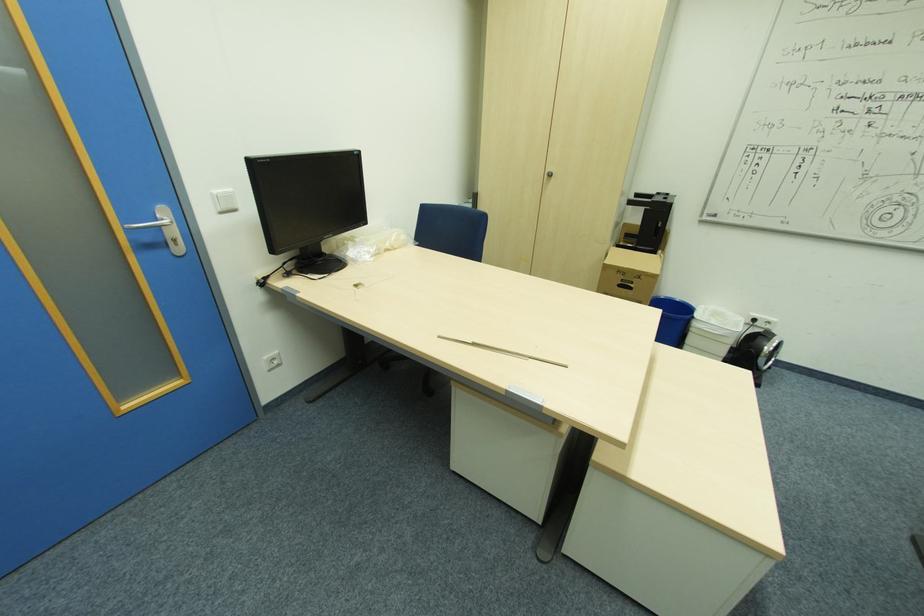
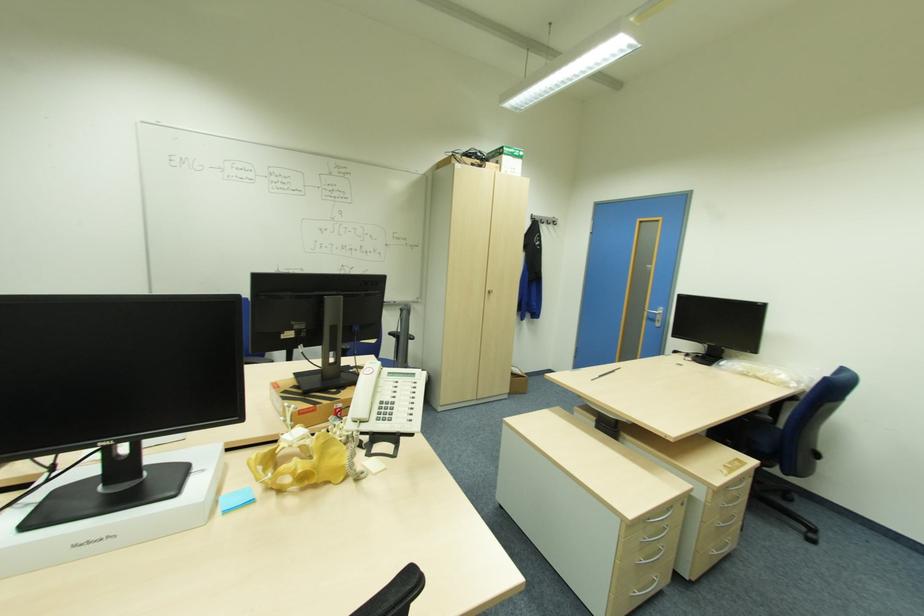
Locate, in the second image, the point that corresponds to (x=176, y=240) in the first image.

(661, 321)